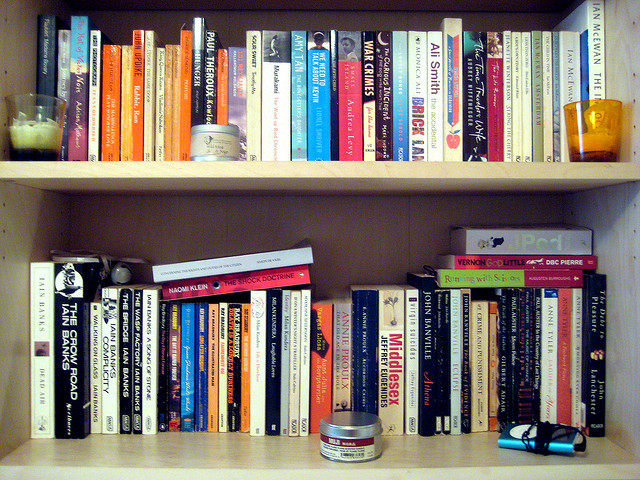
Locate an element on the screen. This screenshot has height=480, width=640. books in a horizontal position is located at coordinates (267, 279), (284, 252), (502, 278), (505, 260), (518, 235).